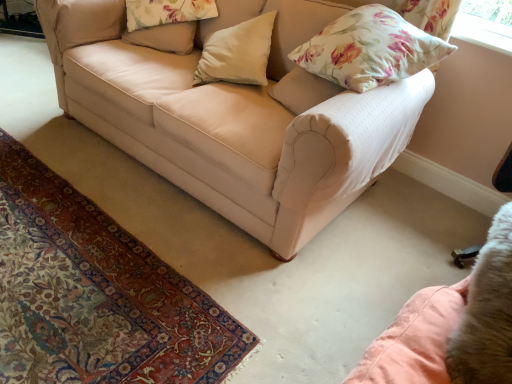
What is the approximate width of beige fabric pillow at upper center, which ranks as the 1th pillow in left-to-right order?

The width of beige fabric pillow at upper center, which ranks as the 1th pillow in left-to-right order, is 4.64 inches.

Image resolution: width=512 pixels, height=384 pixels. In order to click on white matte pillow at center, the 2th pillow from the right in this screenshot , I will do [x=237, y=53].

Based on their sizes in the image, would you say beige fabric pillow at upper center, which ranks as the 1th pillow in left-to-right order, is bigger or smaller than beige fabric couch at center?

Clearly, beige fabric pillow at upper center, which ranks as the 1th pillow in left-to-right order, is smaller in size than beige fabric couch at center.

Can you confirm if beige fabric pillow at upper center, positioned as the 3th pillow in right-to-left order, is positioned to the left of beige fabric couch at center?

Yes, beige fabric pillow at upper center, positioned as the 3th pillow in right-to-left order, is to the left of beige fabric couch at center.

Is beige fabric pillow at upper center, which ranks as the 1th pillow in left-to-right order, placed right next to beige fabric couch at center?

They are not placed beside each other.

Which is farther from the camera, (137, 31) or (180, 58)?

Positioned behind is point (137, 31).

How different are the orientations of beige fabric couch at center and metallic silver swivel chair at lower right in degrees?

The angle between the facing direction of beige fabric couch at center and the facing direction of metallic silver swivel chair at lower right is 94.9 degrees.

From the image's perspective, is beige fabric couch at center located beneath metallic silver swivel chair at lower right?

Incorrect, from the image's perspective, beige fabric couch at center is higher than metallic silver swivel chair at lower right.

In the scene shown: Is beige fabric couch at center wider than metallic silver swivel chair at lower right?

Yes.

Is beige fabric couch at center shorter than metallic silver swivel chair at lower right?

Incorrect, the height of beige fabric couch at center does not fall short of that of metallic silver swivel chair at lower right.

Could you tell me if white matte pillow at center, the 2th pillow from the right, is turned towards beige fabric couch at center?

Yes, white matte pillow at center, the 2th pillow from the right, is turned towards beige fabric couch at center.

Does point (254, 48) appear closer or farther from the camera than point (316, 183)?

Point (254, 48) is farther from the camera than point (316, 183).

In the scene shown: How many degrees apart are the facing directions of white matte pillow at center, marked as the second pillow in a left-to-right arrangement, and beige fabric couch at center?

The angle between the facing direction of white matte pillow at center, marked as the second pillow in a left-to-right arrangement, and the facing direction of beige fabric couch at center is 30.5 degrees.

Can you confirm if white matte pillow at center, marked as the second pillow in a left-to-right arrangement, is taller than beige fabric couch at center?

In fact, white matte pillow at center, marked as the second pillow in a left-to-right arrangement, may be shorter than beige fabric couch at center.

How many degrees apart are the facing directions of beige fabric pillow at upper center, which ranks as the 1th pillow in left-to-right order, and white matte pillow at center, the 2th pillow from the right?

0.000445 degrees separate the facing orientations of beige fabric pillow at upper center, which ranks as the 1th pillow in left-to-right order, and white matte pillow at center, the 2th pillow from the right.

Are beige fabric pillow at upper center, positioned as the 3th pillow in right-to-left order, and white matte pillow at center, the 2th pillow from the right, located far from each other?

Actually, beige fabric pillow at upper center, positioned as the 3th pillow in right-to-left order, and white matte pillow at center, the 2th pillow from the right, are a little close together.

Between beige fabric pillow at upper center, positioned as the 3th pillow in right-to-left order, and white matte pillow at center, marked as the second pillow in a left-to-right arrangement, which one has smaller width?

beige fabric pillow at upper center, positioned as the 3th pillow in right-to-left order.

Can you tell me how much beige fabric couch at center and white matte pillow at center, marked as the second pillow in a left-to-right arrangement, differ in facing direction?

beige fabric couch at center and white matte pillow at center, marked as the second pillow in a left-to-right arrangement, are facing 30.5 degrees away from each other.

Does beige fabric couch at center turn towards white matte pillow at center, marked as the second pillow in a left-to-right arrangement?

Yes, beige fabric couch at center faces towards white matte pillow at center, marked as the second pillow in a left-to-right arrangement.

Which point is more forward, (189, 184) or (265, 45)?

Point (189, 184)

Would you say white matte pillow at center, marked as the second pillow in a left-to-right arrangement, is inside or outside floral fabric pillow at upper right, which is the first pillow in right-to-left order?

white matte pillow at center, marked as the second pillow in a left-to-right arrangement, cannot be found inside floral fabric pillow at upper right, which is the first pillow in right-to-left order.

From a real-world perspective, is white matte pillow at center, the 2th pillow from the right, positioned over floral fabric pillow at upper right, which is the first pillow in right-to-left order, based on gravity?

No, from a real-world perspective, white matte pillow at center, the 2th pillow from the right, is not on top of floral fabric pillow at upper right, which is the first pillow in right-to-left order.

Is white matte pillow at center, the 2th pillow from the right, at the left side of floral fabric pillow at upper right, which is the first pillow in right-to-left order?

Correct, you'll find white matte pillow at center, the 2th pillow from the right, to the left of floral fabric pillow at upper right, which is the first pillow in right-to-left order.

Considering the sizes of objects white matte pillow at center, marked as the second pillow in a left-to-right arrangement, and floral fabric pillow at upper right, which is the first pillow in right-to-left order, in the image provided, who is bigger, white matte pillow at center, marked as the second pillow in a left-to-right arrangement, or floral fabric pillow at upper right, which is the first pillow in right-to-left order,?

floral fabric pillow at upper right, which is the first pillow in right-to-left order.

Which of these two, floral fabric pillow at upper right, which is the first pillow in right-to-left order, or white matte pillow at center, marked as the second pillow in a left-to-right arrangement, is wider?

white matte pillow at center, marked as the second pillow in a left-to-right arrangement.

Is floral fabric pillow at upper right, the third pillow from the left, taller than white matte pillow at center, marked as the second pillow in a left-to-right arrangement?

No.

Is floral fabric pillow at upper right, which is the first pillow in right-to-left order, far away from white matte pillow at center, marked as the second pillow in a left-to-right arrangement?

A: No, floral fabric pillow at upper right, which is the first pillow in right-to-left order, is in close proximity to white matte pillow at center, marked as the second pillow in a left-to-right arrangement.

From the image's perspective, is floral fabric pillow at upper right, which is the first pillow in right-to-left order, under white matte pillow at center, the 2th pillow from the right?

Yes, from the image's perspective, floral fabric pillow at upper right, which is the first pillow in right-to-left order, is below white matte pillow at center, the 2th pillow from the right.

The width and height of the screenshot is (512, 384). I want to click on studio couch that appears below the beige fabric pillow at upper center, positioned as the 3th pillow in right-to-left order (from the image's perspective), so click(x=234, y=116).

In order to click on studio couch behind the metallic silver swivel chair at lower right in this screenshot , I will do `click(234, 116)`.

From the image, which object appears to be nearer to white matte pillow at center, the 2th pillow from the right, floral fabric pillow at upper right, the third pillow from the left, or beige fabric pillow at upper center, positioned as the 3th pillow in right-to-left order?

beige fabric pillow at upper center, positioned as the 3th pillow in right-to-left order.

Estimate the real-world distances between objects in this image. Which object is closer to metallic silver swivel chair at lower right, white matte pillow at center, the 2th pillow from the right, or beige fabric couch at center?

beige fabric couch at center lies closer to metallic silver swivel chair at lower right than the other object.

When comparing their distances from metallic silver swivel chair at lower right, does beige fabric couch at center or beige fabric pillow at upper center, which ranks as the 1th pillow in left-to-right order, seem closer?

The object closer to metallic silver swivel chair at lower right is beige fabric couch at center.

From the image, which object appears to be nearer to beige fabric couch at center, white matte pillow at center, the 2th pillow from the right, or metallic silver swivel chair at lower right?

white matte pillow at center, the 2th pillow from the right, is closer to beige fabric couch at center.

Based on their spatial positions, is white matte pillow at center, marked as the second pillow in a left-to-right arrangement, or beige fabric couch at center closer to beige fabric pillow at upper center, which ranks as the 1th pillow in left-to-right order?

white matte pillow at center, marked as the second pillow in a left-to-right arrangement.

Based on their spatial positions, is beige fabric pillow at upper center, which ranks as the 1th pillow in left-to-right order, or white matte pillow at center, the 2th pillow from the right, further from floral fabric pillow at upper right, which is the first pillow in right-to-left order?

Based on the image, beige fabric pillow at upper center, which ranks as the 1th pillow in left-to-right order, appears to be further to floral fabric pillow at upper right, which is the first pillow in right-to-left order.

Looking at the image, which one is located closer to floral fabric pillow at upper right, which is the first pillow in right-to-left order, metallic silver swivel chair at lower right or white matte pillow at center, marked as the second pillow in a left-to-right arrangement?

white matte pillow at center, marked as the second pillow in a left-to-right arrangement, is positioned closer to the anchor floral fabric pillow at upper right, which is the first pillow in right-to-left order.

Looking at the image, which one is located further to metallic silver swivel chair at lower right, white matte pillow at center, the 2th pillow from the right, or beige fabric pillow at upper center, which ranks as the 1th pillow in left-to-right order?

beige fabric pillow at upper center, which ranks as the 1th pillow in left-to-right order, is positioned further to the anchor metallic silver swivel chair at lower right.

You are a GUI agent. You are given a task and a screenshot of the screen. Output one action in this format:
    pyautogui.click(x=<x>, y=<y>)
    Task: Click on the studio couch between metallic silver swivel chair at lower right and white matte pillow at center, the 2th pillow from the right, in the front-back direction
    This screenshot has width=512, height=384.
    Given the screenshot: What is the action you would take?
    pyautogui.click(x=234, y=116)

Where is `pillow between beige fabric couch at center and floral fabric pillow at upper right, the third pillow from the left, from left to right`? pillow between beige fabric couch at center and floral fabric pillow at upper right, the third pillow from the left, from left to right is located at coordinates (237, 53).

You are a GUI agent. You are given a task and a screenshot of the screen. Output one action in this format:
    pyautogui.click(x=<x>, y=<y>)
    Task: Click on the pillow situated between beige fabric pillow at upper center, which ranks as the 1th pillow in left-to-right order, and floral fabric pillow at upper right, the third pillow from the left, from left to right
    
    Given the screenshot: What is the action you would take?
    pyautogui.click(x=237, y=53)

What are the coordinates of `pillow between metallic silver swivel chair at lower right and white matte pillow at center, the 2th pillow from the right, in the front-back direction` in the screenshot? It's located at (378, 45).